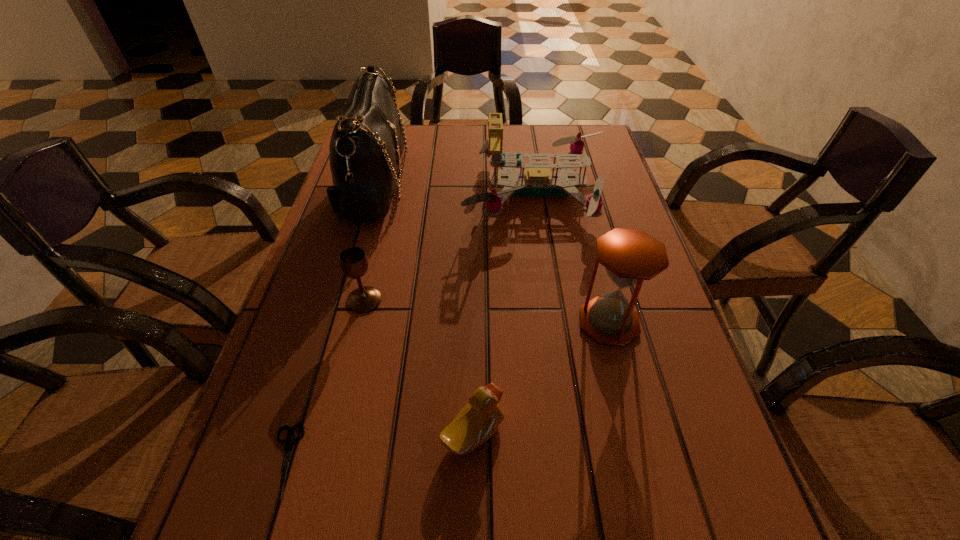
You are a GUI agent. You are given a task and a screenshot of the screen. Output one action in this format:
    pyautogui.click(x=<x>, y=<y>)
    Task: Click on the free space that satisfies the following two spatial constraints: 1. at the front of the hourglass with chain and zipper; 2. on the right side of the handbag
    The width and height of the screenshot is (960, 540).
    Given the screenshot: What is the action you would take?
    pyautogui.click(x=334, y=322)

Identify the location of free spot that satisfies the following two spatial constraints: 1. at the front of the handbag with chain and zipper; 2. on the front side of the shortest object. The image size is (960, 540). (294, 461).

The width and height of the screenshot is (960, 540). What are the coordinates of `free location that satisfies the following two spatial constraints: 1. on the back side of the chalice; 2. at the front of the tallest object with chain and zipper` in the screenshot? It's located at (392, 187).

The image size is (960, 540). Identify the location of vacant space that satisfies the following two spatial constraints: 1. on the back side of the hourglass; 2. on the front-facing side of the drone. (575, 191).